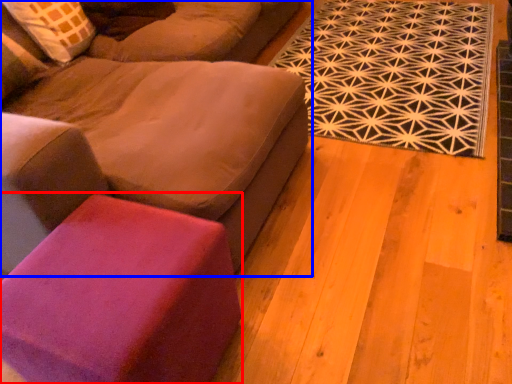
Question: Among these objects, which one is farthest to the camera, stool (highlighted by a red box) or studio couch (highlighted by a blue box)?

Choices:
 (A) stool
 (B) studio couch

Answer: (A)